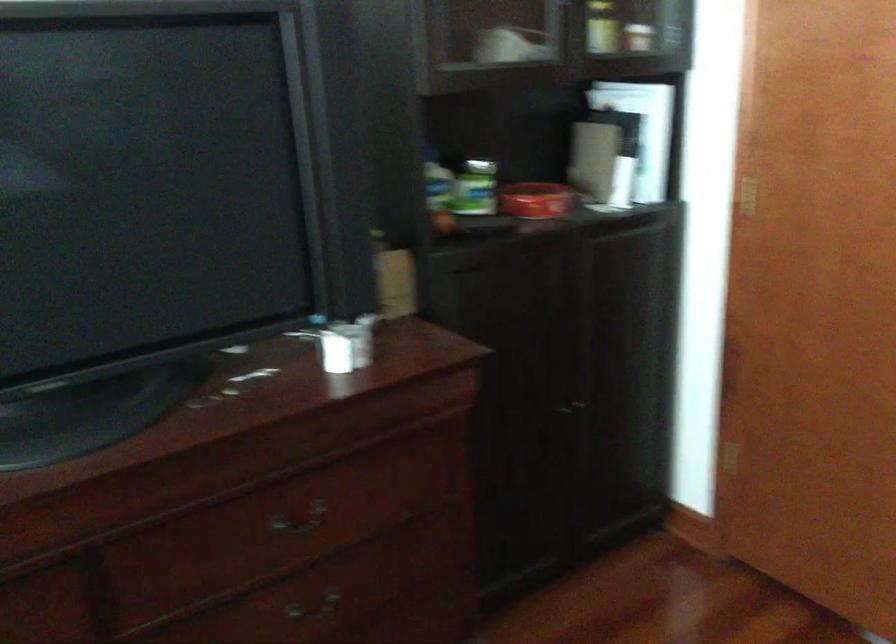
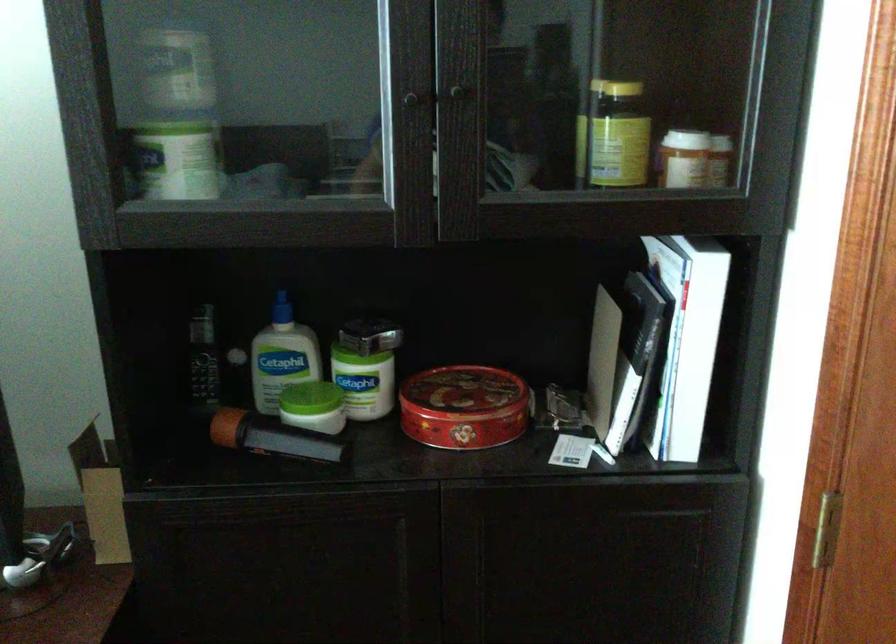
Find the pixel in the second image that matches the point at 666,154 in the first image.

(728, 373)